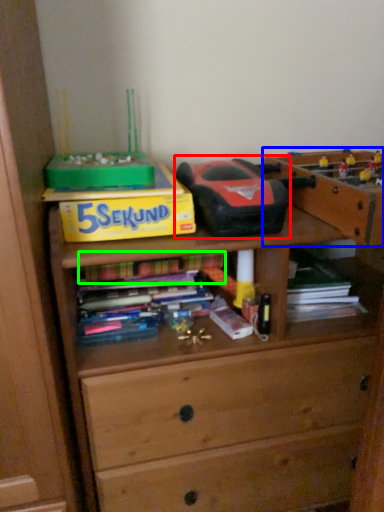
Question: Based on their relative distances, which object is nearer to toy (highlighted by a red box)? Choose from cabinetry (highlighted by a blue box) and book (highlighted by a green box).

Choices:
 (A) cabinetry
 (B) book

Answer: (A)